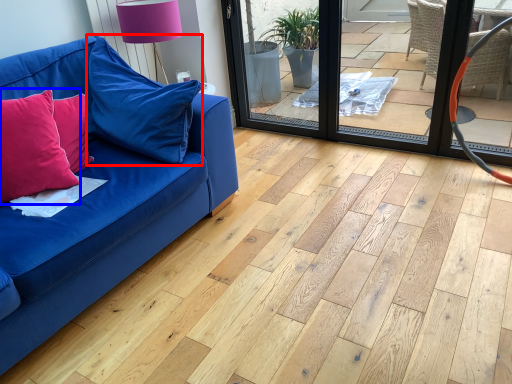
Question: Which point is further to the camera, pillow (highlighted by a red box) or pillow (highlighted by a blue box)?

Choices:
 (A) pillow
 (B) pillow

Answer: (A)